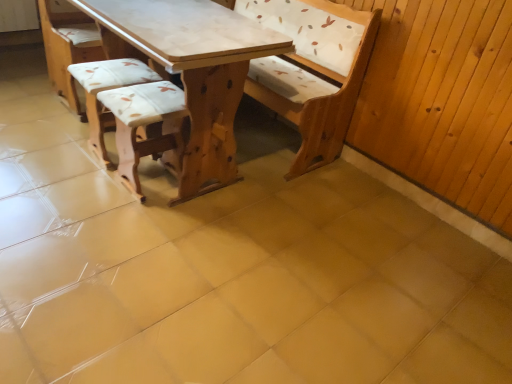
Question: Is white fabric cushion at center, positioned as the 2th armchair in right-to-left order, thinner than wooden textured stool at center, which is the first armchair in right-to-left order?

Choices:
 (A) yes
 (B) no

Answer: (A)

Question: Is white fabric cushion at center, positioned as the 2th armchair in right-to-left order, oriented towards wooden textured stool at center, the second armchair positioned from the left?

Choices:
 (A) no
 (B) yes

Answer: (A)

Question: Considering the relative sizes of white fabric cushion at center, positioned as the 2th armchair in right-to-left order, and wooden textured stool at center, which is the first armchair in right-to-left order, in the image provided, is white fabric cushion at center, positioned as the 2th armchair in right-to-left order, shorter than wooden textured stool at center, which is the first armchair in right-to-left order,?

Choices:
 (A) yes
 (B) no

Answer: (A)

Question: Is white fabric cushion at center, the first armchair in the left-to-right sequence, oriented away from wooden textured stool at center, the second armchair positioned from the left?

Choices:
 (A) no
 (B) yes

Answer: (A)

Question: Considering the relative sizes of white fabric cushion at center, the first armchair in the left-to-right sequence, and wooden textured stool at center, the second armchair positioned from the left, in the image provided, is white fabric cushion at center, the first armchair in the left-to-right sequence, taller than wooden textured stool at center, the second armchair positioned from the left,?

Choices:
 (A) yes
 (B) no

Answer: (B)

Question: From a real-world perspective, is white fabric cushion at center, the first armchair in the left-to-right sequence, on top of wooden textured stool at center, which is the first armchair in right-to-left order?

Choices:
 (A) yes
 (B) no

Answer: (B)

Question: Can we say wooden textured stool at center, the second armchair positioned from the left, lies outside white fabric cushion at center, the first armchair in the left-to-right sequence?

Choices:
 (A) no
 (B) yes

Answer: (B)

Question: Is wooden textured stool at center, which is the first armchair in right-to-left order, to the left of white fabric cushion at center, the first armchair in the left-to-right sequence, from the viewer's perspective?

Choices:
 (A) yes
 (B) no

Answer: (B)

Question: Could you tell me if wooden textured stool at center, the second armchair positioned from the left, is facing white fabric cushion at center, the first armchair in the left-to-right sequence?

Choices:
 (A) no
 (B) yes

Answer: (A)

Question: Does wooden textured stool at center, the second armchair positioned from the left, have a greater height compared to white fabric cushion at center, positioned as the 2th armchair in right-to-left order?

Choices:
 (A) yes
 (B) no

Answer: (A)

Question: From the image's perspective, does wooden textured stool at center, the second armchair positioned from the left, appear lower than white fabric cushion at center, positioned as the 2th armchair in right-to-left order?

Choices:
 (A) no
 (B) yes

Answer: (B)

Question: Can you confirm if wooden textured stool at center, which is the first armchair in right-to-left order, is positioned to the right of white fabric cushion at center, positioned as the 2th armchair in right-to-left order?

Choices:
 (A) no
 (B) yes

Answer: (B)

Question: Can you confirm if light brown wood table at center is bigger than wooden textured stool at center, the second armchair positioned from the left?

Choices:
 (A) yes
 (B) no

Answer: (A)